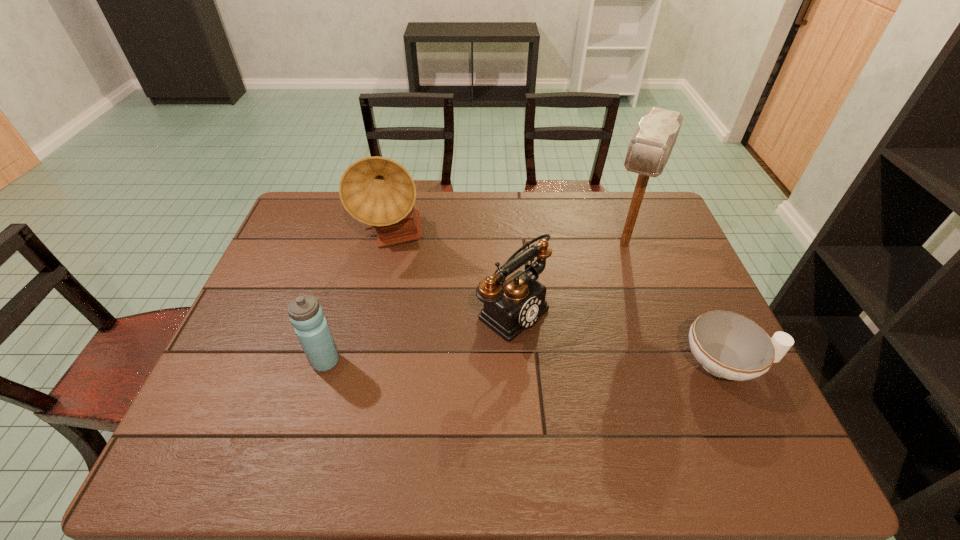
I want to click on vacant space positioned 0.070m on the front of the third object from right to left at the rotary dial, so click(x=562, y=348).

This screenshot has height=540, width=960. Identify the location of vacant space located 0.080m on the front of the third object from right to left at the rotary dial. (564, 350).

I want to click on vacant position located 0.240m above the head of the mallet, so click(594, 316).

Locate an element on the screen. free region located 0.270m above the head of the mallet is located at coordinates (x=591, y=324).

This screenshot has width=960, height=540. Identify the location of free location located above the head of the mallet. (588, 332).

I want to click on phonograph record present at the far edge, so click(x=377, y=191).

Locate an element on the screen. mallet that is at the far edge is located at coordinates (650, 147).

Where is `object at the near edge`? object at the near edge is located at coordinates (728, 345).

Find the location of `chinaware located in the right edge section of the desktop`. chinaware located in the right edge section of the desktop is located at coordinates (728, 345).

Locate an element on the screen. This screenshot has width=960, height=540. mallet that is at the right edge is located at coordinates (650, 147).